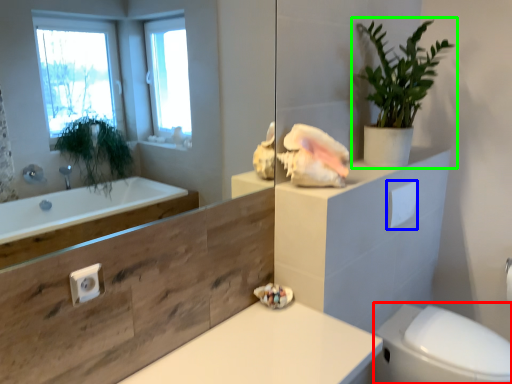
Question: Estimate the real-world distances between objects in this image. Which object is closer to bidet (highlighted by a red box), toilet paper (highlighted by a blue box) or houseplant (highlighted by a green box)?

Choices:
 (A) toilet paper
 (B) houseplant

Answer: (A)